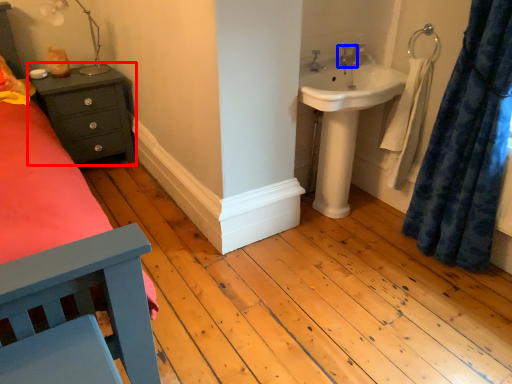
Question: Among these objects, which one is nearest to the camera, nightstand (highlighted by a red box) or tap (highlighted by a blue box)?

Choices:
 (A) nightstand
 (B) tap

Answer: (B)